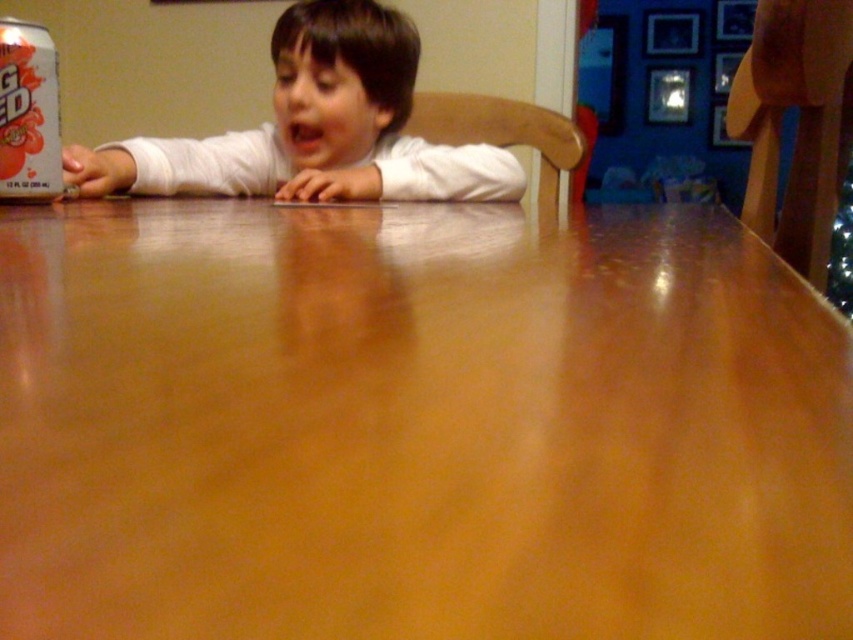
Question: Among these points, which one is farthest from the camera?

Choices:
 (A) (21, 102)
 (B) (102, 260)
 (C) (309, 28)

Answer: (C)

Question: Is white matte shirt at center smaller than matte silver can at upper left?

Choices:
 (A) yes
 (B) no

Answer: (B)

Question: Which point is farther to the camera?

Choices:
 (A) [x=299, y=371]
 (B) [x=224, y=188]

Answer: (B)

Question: Considering the real-world distances, which object is closest to the matte silver can at upper left?

Choices:
 (A) white matte shirt at center
 (B) wooden table at center

Answer: (A)

Question: Does wooden table at center lie in front of matte silver can at upper left?

Choices:
 (A) yes
 (B) no

Answer: (A)

Question: In this image, where is wooden table at center located relative to white matte shirt at center?

Choices:
 (A) right
 (B) left

Answer: (A)